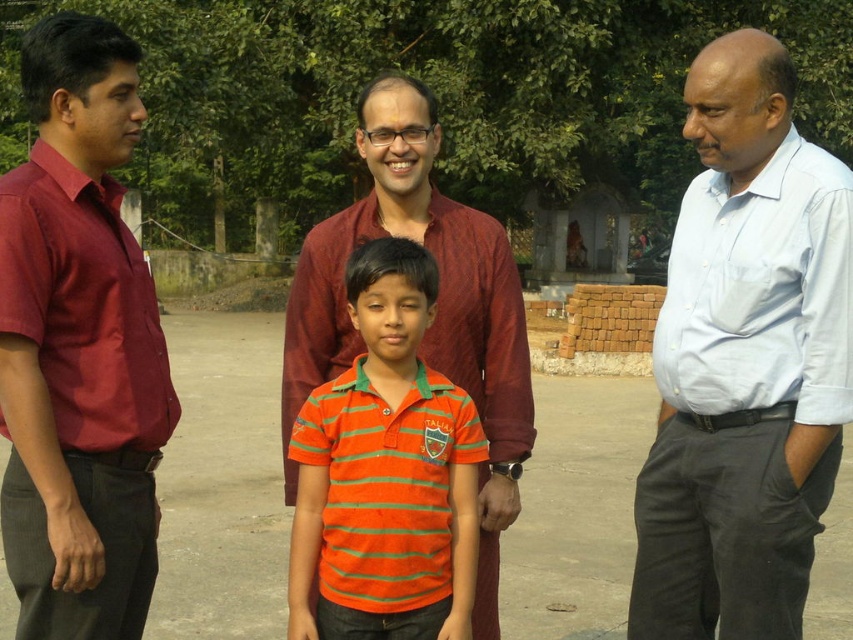
Is light blue shirt at right wider than orange striped polo shirt at center?

Correct, the width of light blue shirt at right exceeds that of orange striped polo shirt at center.

Does light blue shirt at right have a larger size compared to orange striped polo shirt at center?

Correct, light blue shirt at right is larger in size than orange striped polo shirt at center.

Which is behind, point (798, 346) or point (368, 484)?

The point (798, 346) is behind.

The image size is (853, 640). Find the location of `light blue shirt at right`. light blue shirt at right is located at coordinates (746, 362).

Which is more to the right, light blue shirt at right or light blue cotton shirt at right?

light blue cotton shirt at right

Is point (715, 276) less distant than point (764, 291)?

No, it is behind (764, 291).

Image resolution: width=853 pixels, height=640 pixels. I want to click on light blue shirt at right, so click(746, 362).

Is light blue shirt at right positioned before maroon shirt at left?

No, light blue shirt at right is behind maroon shirt at left.

Does point (749, 595) lie in front of point (16, 524)?

No.

Which is behind, point (795, 580) or point (154, 410)?

Point (795, 580)

This screenshot has width=853, height=640. I want to click on light blue shirt at right, so click(x=746, y=362).